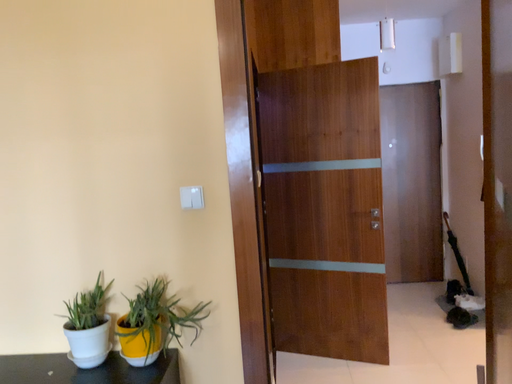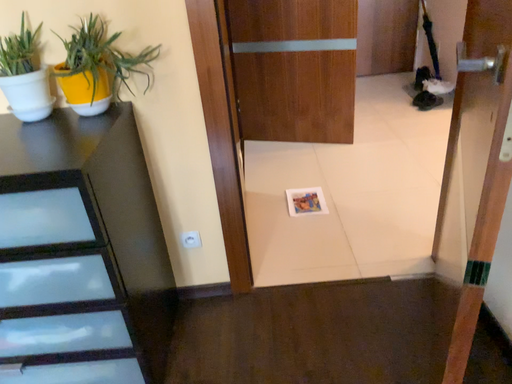
Question: Which way did the camera rotate in the video?

Choices:
 (A) rotated downward
 (B) rotated upward

Answer: (A)